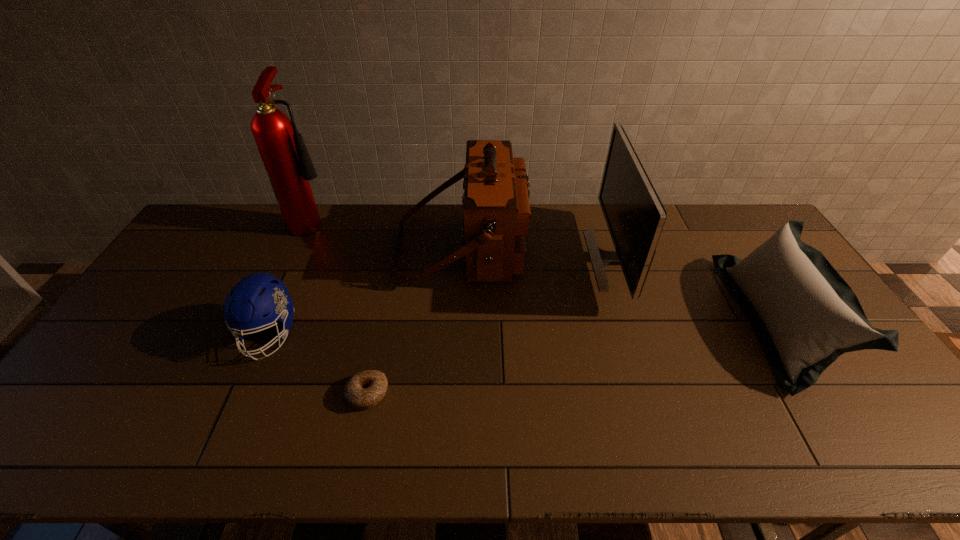
In order to click on vacant region located 0.090m on the face side of the satchel in this screenshot , I will do `click(554, 247)`.

The image size is (960, 540). In order to click on vacant space located on the surface of the rightmost object in this screenshot , I will do `click(684, 320)`.

This screenshot has height=540, width=960. I want to click on vacant region located 0.270m on the surface of the rightmost object, so click(649, 320).

In order to click on vacant point located on the surface of the rightmost object in this screenshot , I will do `click(659, 320)`.

Identify the location of vacant area located on the face guard of the football helmet. The width and height of the screenshot is (960, 540). (230, 422).

This screenshot has height=540, width=960. Identify the location of free space located 0.160m on the back of the shortest object. (381, 327).

Where is `fire extinguisher positioned at the far edge`? fire extinguisher positioned at the far edge is located at coordinates (289, 167).

Identify the location of monitor present at the far edge. This screenshot has height=540, width=960. (635, 216).

Image resolution: width=960 pixels, height=540 pixels. Find the location of `satchel present at the far edge`. satchel present at the far edge is located at coordinates (496, 209).

Image resolution: width=960 pixels, height=540 pixels. What are the coordinates of `object at the right edge` in the screenshot? It's located at (803, 313).